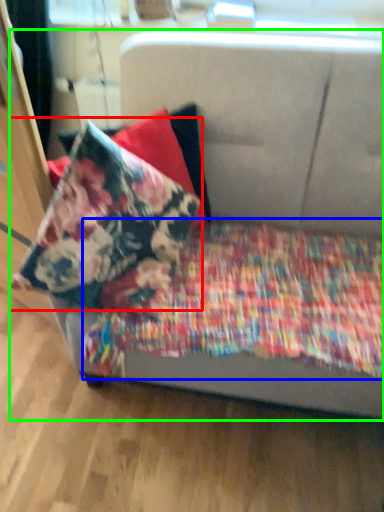
Question: Based on their relative distances, which object is farther from pillow (highlighted by a red box)? Choose from blanket (highlighted by a blue box) and studio couch (highlighted by a green box).

Choices:
 (A) blanket
 (B) studio couch

Answer: (B)